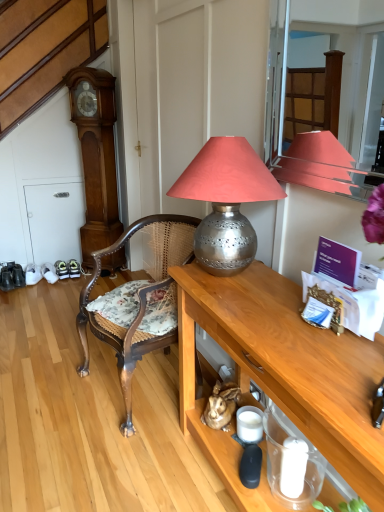
This screenshot has height=512, width=384. I want to click on vacant area that is in front of silver metallic lampshade at center, so click(266, 318).